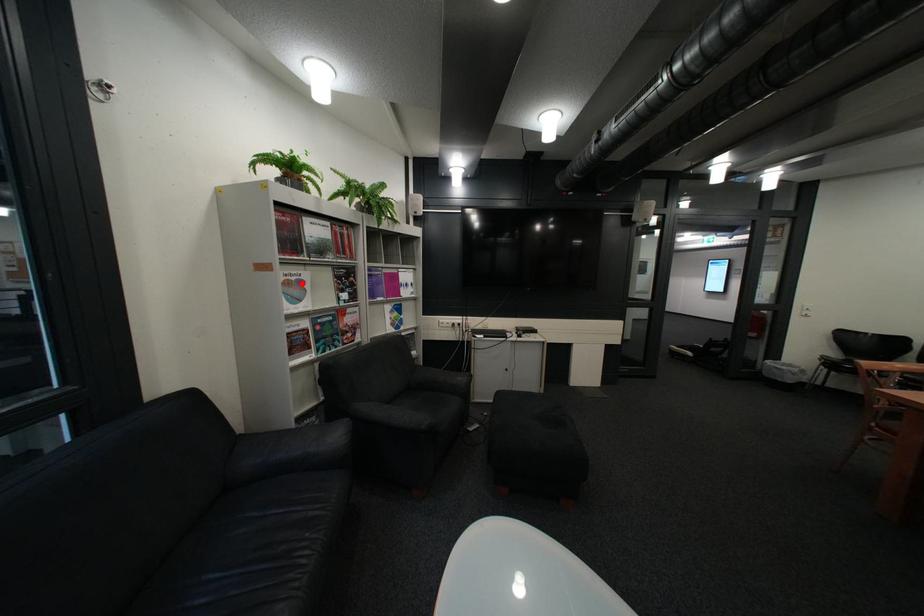
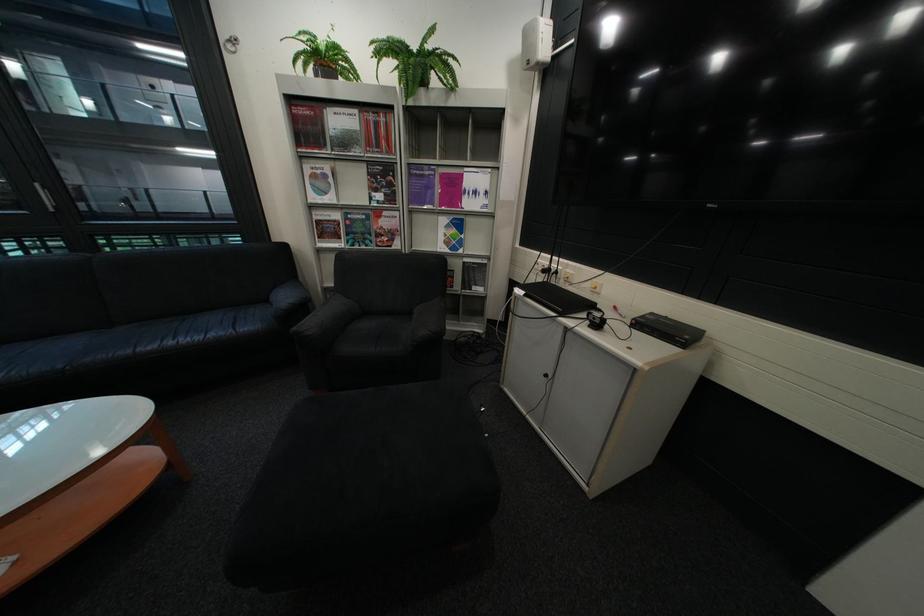
The point at the highlighted location is marked in the first image. Where is the corresponding point in the second image?

(329, 177)